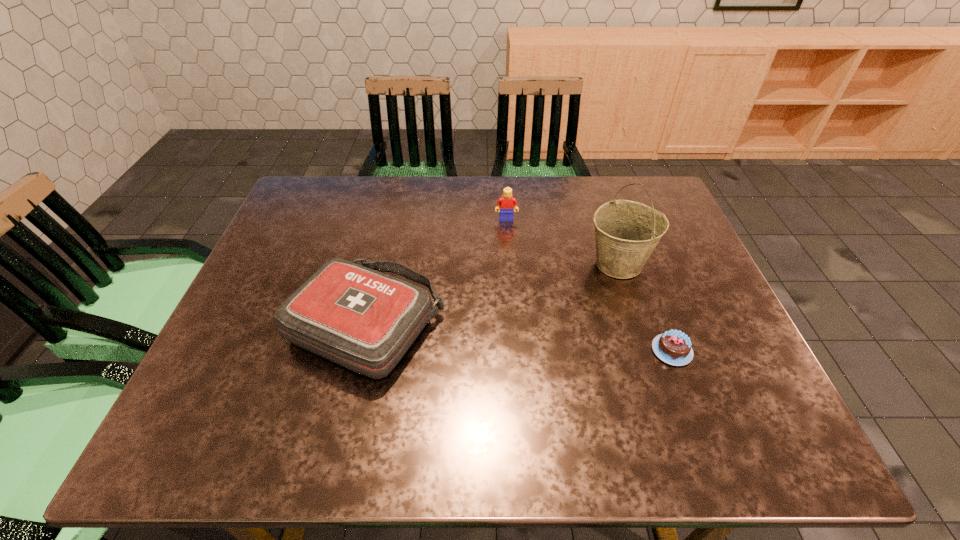
Where is `vacant space that satisfies the following two spatial constraints: 1. on the face of the tallest object; 2. on the left side of the Lego`? vacant space that satisfies the following two spatial constraints: 1. on the face of the tallest object; 2. on the left side of the Lego is located at coordinates (510, 264).

What are the coordinates of `vacant point that satisfies the following two spatial constraints: 1. on the face of the tallest object; 2. on the right side of the farthest object` in the screenshot? It's located at (510, 264).

Identify the location of free location that satisfies the following two spatial constraints: 1. on the front side of the wine bucket; 2. on the left side of the shortest object. Image resolution: width=960 pixels, height=540 pixels. (646, 350).

Identify the location of free space that satisfies the following two spatial constraints: 1. on the back side of the wine bucket; 2. on the right side of the first-aid kit. (381, 264).

You are a GUI agent. You are given a task and a screenshot of the screen. Output one action in this format:
    pyautogui.click(x=<x>, y=<y>)
    Task: Click on the vacant point that satisfies the following two spatial constraints: 1. on the front side of the chocolate cake; 2. on the left side of the tallest object
    This screenshot has width=960, height=540.
    Given the screenshot: What is the action you would take?
    pyautogui.click(x=646, y=350)

Where is `vacant space that satisfies the following two spatial constraints: 1. on the face of the chocolate cake; 2. on the right side of the farthest object`? This screenshot has height=540, width=960. vacant space that satisfies the following two spatial constraints: 1. on the face of the chocolate cake; 2. on the right side of the farthest object is located at coordinates [x=516, y=350].